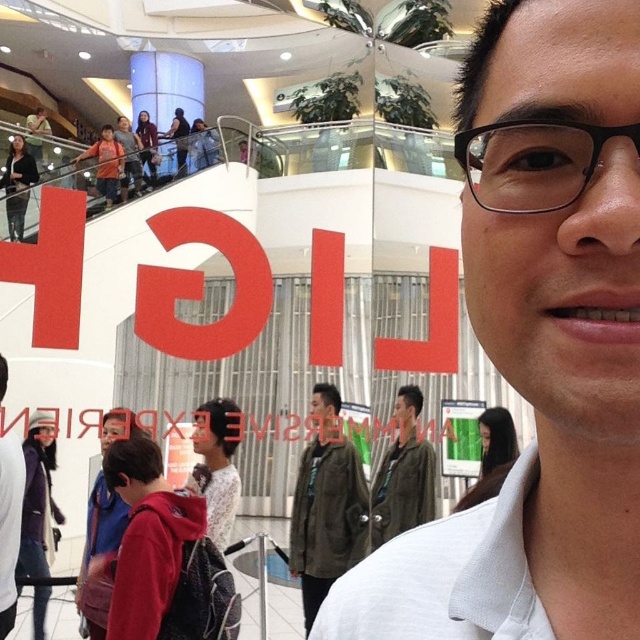
You are a photographer trying to capture a clear shot of the white matte shirt at center and the black plastic glasses at upper right. Since you want both objects to be equally visible in the photo, which one should you zoom in on more?

The white matte shirt at center is larger in size than the black plastic glasses at upper right, so you should zoom in more on the black plastic glasses at upper right to make them appear the same size in the photo.

You are a photographer trying to capture a photo of the white matte shirt at center and the red hoodie at lower left. Which object is shorter?

The white matte shirt at center is shorter than the red hoodie at lower left.

You are a photographer trying to capture a candid shot of the person taking a selfie. You notice the white matte shirt at center and the black plastic glasses at upper right. Which object should you focus on first to ensure both are in frame?

You should focus on the black plastic glasses at upper right first because the white matte shirt at center is located below it, ensuring both will be in frame when starting from the higher position.